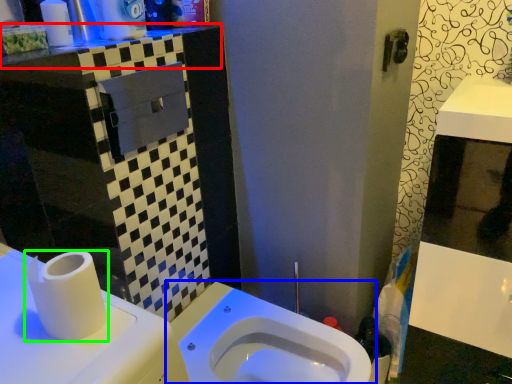
Question: Which object is positioned farthest from counter top (highlighted by a red box)? Select from toilet (highlighted by a blue box) and toilet paper (highlighted by a green box).

Choices:
 (A) toilet
 (B) toilet paper

Answer: (A)